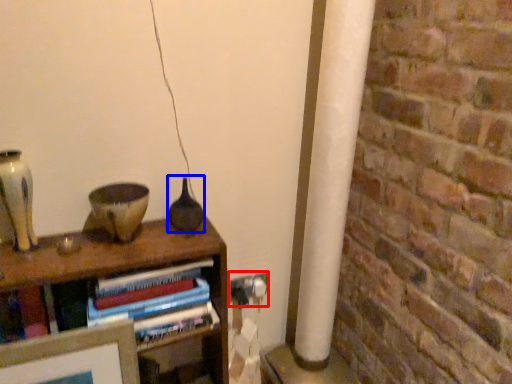
Question: Among these objects, which one is farthest to the camera, electric outlet (highlighted by a red box) or glass vase (highlighted by a blue box)?

Choices:
 (A) electric outlet
 (B) glass vase

Answer: (A)